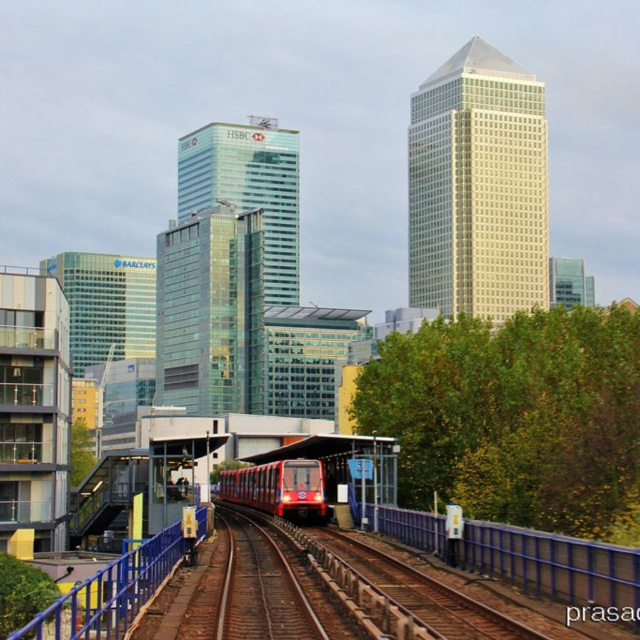
Which is more to the right, blue metallic rail at center or metallic red train at center?

Positioned to the right is blue metallic rail at center.

Locate an element on the screen. blue metallic rail at center is located at coordinates click(556, 566).

Find the location of a particular element. blue metallic rail at center is located at coordinates (556, 566).

How distant is blue metallic rail at lower left from metallic red train at center?

blue metallic rail at lower left and metallic red train at center are 82.44 feet apart.

Based on the photo, who is more forward, (x=173, y=532) or (x=257, y=500)?

Point (x=173, y=532) is more forward.

Which is behind, point (160, 547) or point (310, 486)?

Positioned behind is point (310, 486).

Find the location of a particular element. Image resolution: width=640 pixels, height=640 pixels. blue metallic rail at lower left is located at coordinates (109, 593).

Which is in front, point (566, 540) or point (140, 605)?

Point (140, 605) is in front.

Which is below, blue metallic rail at center or blue metallic rail at lower left?

blue metallic rail at lower left

Is point (364, 512) more distant than point (157, 554)?

Yes, it is behind point (157, 554).

Find the location of a particular element. The width and height of the screenshot is (640, 640). blue metallic rail at center is located at coordinates (556, 566).